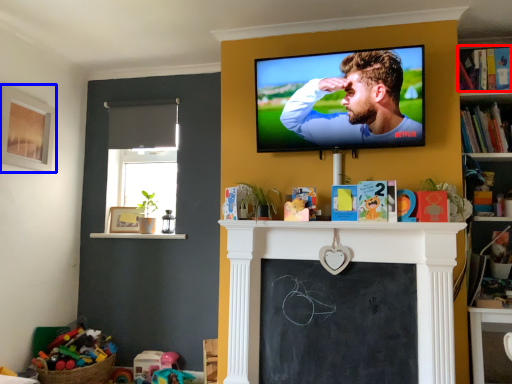
Question: Which object appears closest to the camera in this image, book (highlighted by a red box) or picture frame (highlighted by a blue box)?

Choices:
 (A) book
 (B) picture frame

Answer: (A)